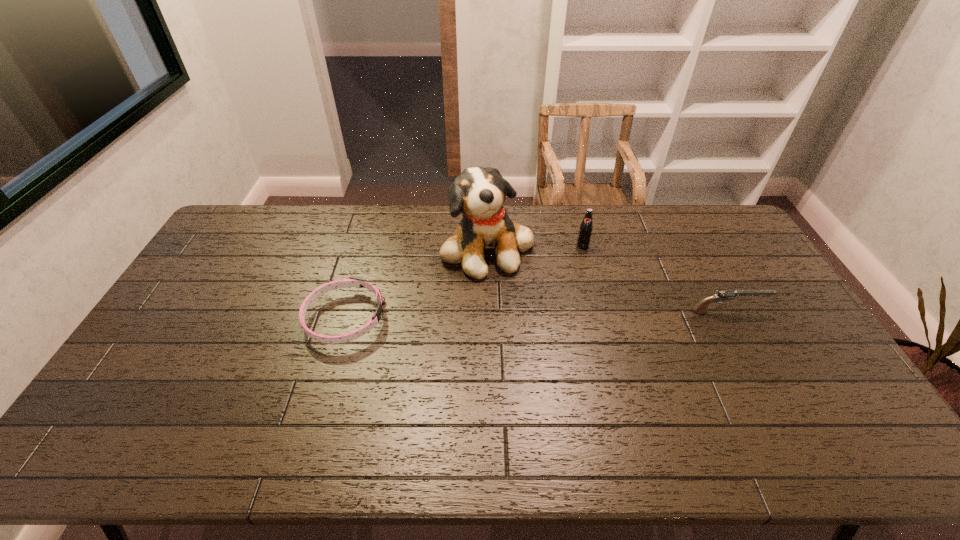
Locate an element on the screen. The width and height of the screenshot is (960, 540). blank space at the near edge of the desktop is located at coordinates (719, 416).

Find the location of a particular element. This screenshot has height=540, width=960. vacant space at the right edge of the desktop is located at coordinates (780, 301).

Image resolution: width=960 pixels, height=540 pixels. In order to click on free space at the near right corner in this screenshot , I will do `click(823, 416)`.

Locate an element on the screen. This screenshot has width=960, height=540. free space between the shortest object and the third shortest object is located at coordinates (464, 282).

Locate an element on the screen. The height and width of the screenshot is (540, 960). unoccupied area between the third shortest object and the third tallest object is located at coordinates (655, 279).

Find the location of a particular element. free space between the leftmost object and the second object from right to left is located at coordinates (464, 282).

Locate an element on the screen. This screenshot has width=960, height=540. free space between the tallest object and the second object from right to left is located at coordinates click(x=535, y=246).

At what (x,y) coordinates should I click in order to perform the action: click on blank region between the third object from right to left and the third shortest object. Please return your answer as a coordinate pair (x, y). Looking at the image, I should click on (535, 246).

Image resolution: width=960 pixels, height=540 pixels. Identify the location of free spot between the dog collar and the third shortest object. (464, 282).

Where is `blank region between the tallest object and the third shortest object`? blank region between the tallest object and the third shortest object is located at coordinates (535, 246).